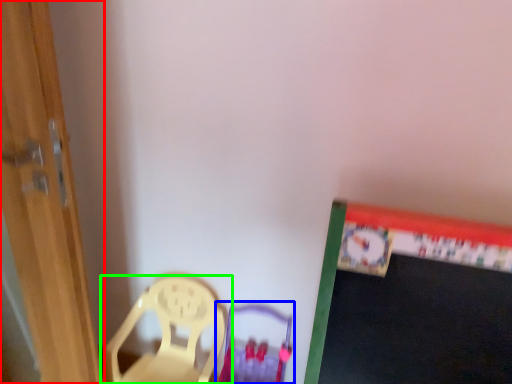
Question: Based on their relative distances, which object is nearer to door (highlighted by a red box)? Choose from armchair (highlighted by a blue box) and chair (highlighted by a green box).

Choices:
 (A) armchair
 (B) chair

Answer: (B)